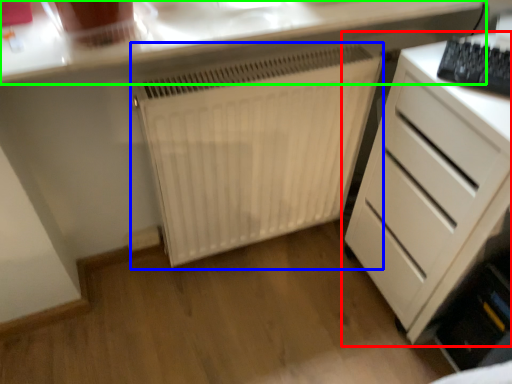
Question: Based on their relative distances, which object is nearer to chest of drawers (highlighted by a red box)? Choose from radiator (highlighted by a blue box) and countertop (highlighted by a green box).

Choices:
 (A) radiator
 (B) countertop

Answer: (A)